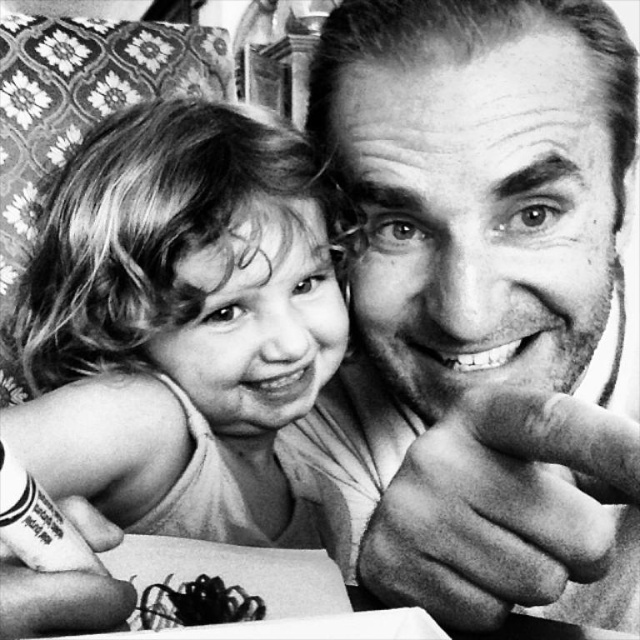
Based on the scene description, where is the smooth skin face at upper right located in the image?

The smooth skin face at upper right is located at the 2D coordinates point of (480, 305) in the image.